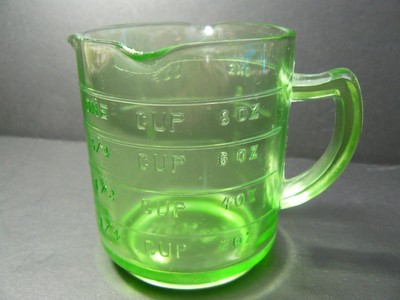
Find the location of a particular element. The width and height of the screenshot is (400, 300). green cup is located at coordinates (226, 152).